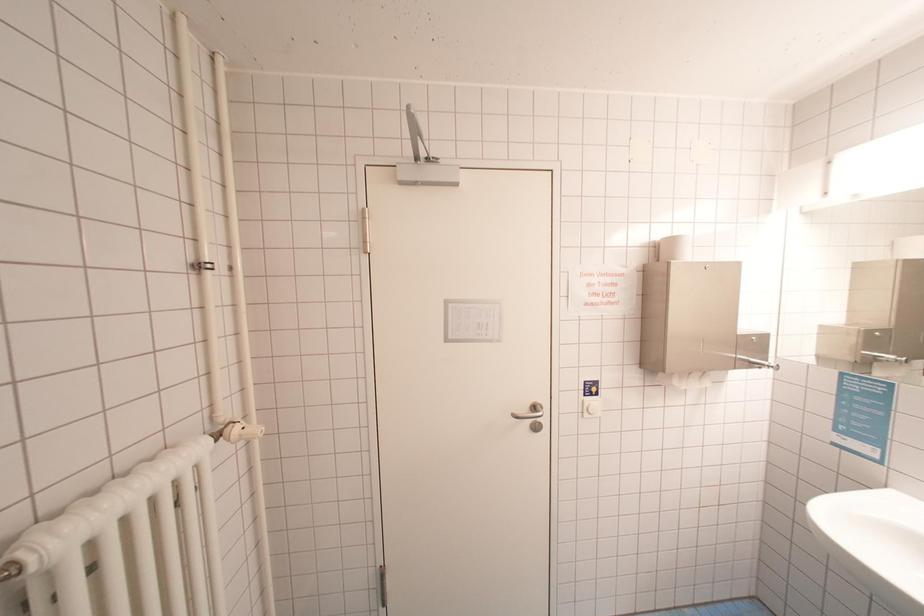
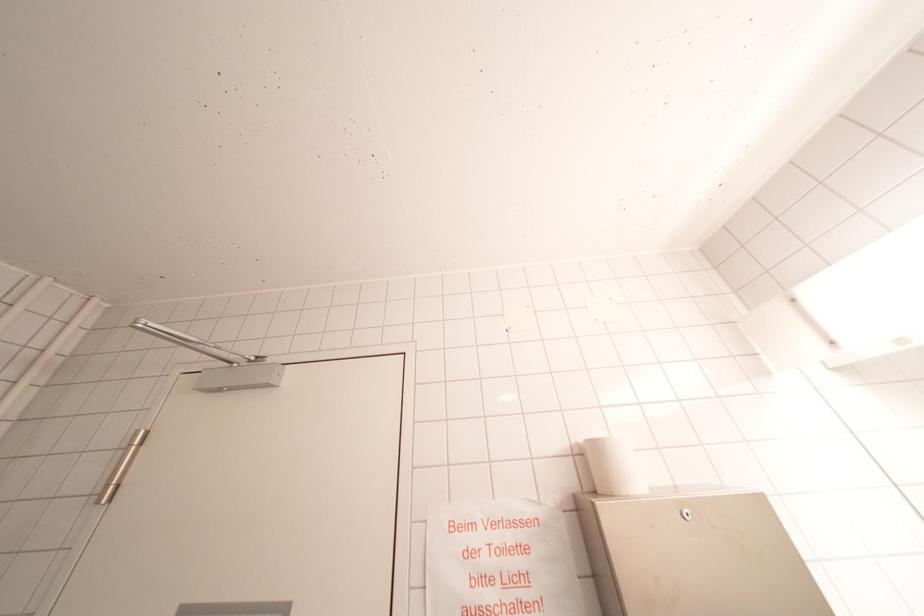
Question: Based on the continuous images, in which direction is the camera rotating? Reply with the corresponding letter.

Choices:
 (A) Left
 (B) Right
 (C) Up
 (D) Down

Answer: (C)